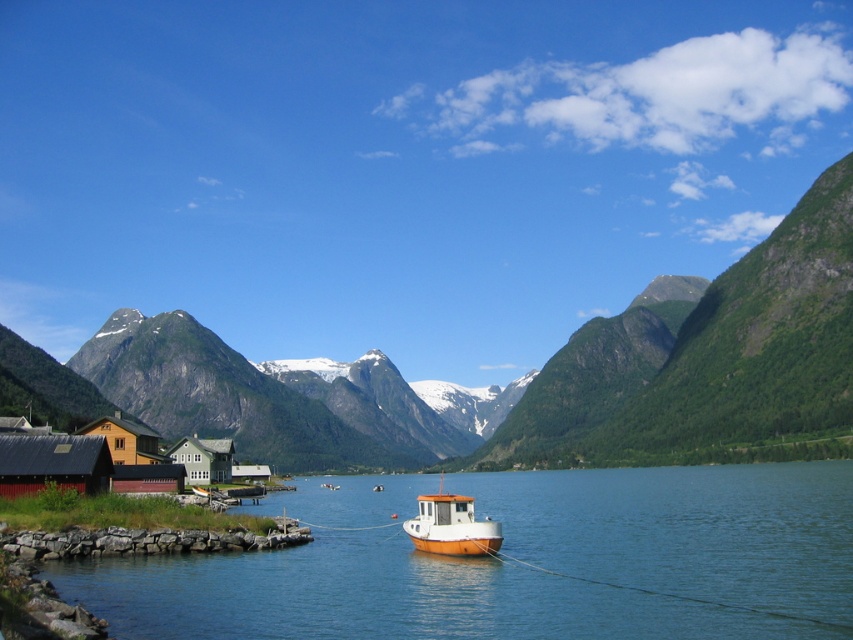
You are standing on the rocky shoreline and want to visit both the yellow wood house at lower left and the green matte house at lower left. Which house should you approach first to be closer to your starting position?

The yellow wood house at lower left is closer to the viewer than the green matte house at lower left, so you should approach the yellow wood house at lower left first since it is nearer to your starting position on the rocky shoreline.

Based on the photo, you are standing at the center of the image and want to locate the yellow wood house at lower left. According to the coordinates provided, in which direction should you look to find it?

The yellow wood house at lower left is located at coordinates point (126, 440), which means it is positioned to the lower left from your current position at the center of the image.

You are planning to take a photo of the green grassy mountain at center and the green matte house at lower left. Which object should you focus on first if you want to capture both in one frame without moving the camera?

You should focus on the green grassy mountain at center first because it is larger than the green matte house at lower left, ensuring it fits well within the frame.